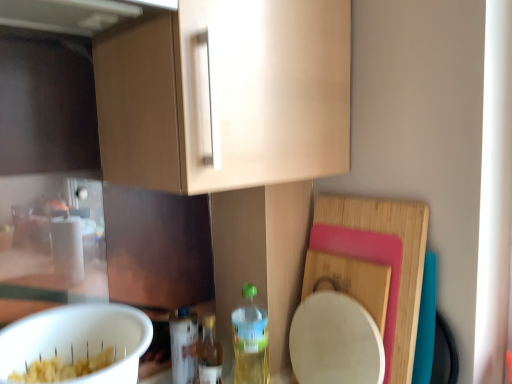
Question: Can you confirm if translucent plastic bottle at lower center, the third bottle in the right-to-left sequence, is smaller than translucent plastic bottle at lower center, the 2th bottle viewed from the right?

Choices:
 (A) no
 (B) yes

Answer: (A)

Question: Is translucent plastic bottle at lower center, arranged as the 1th bottle when viewed from the left, aimed at translucent plastic bottle at lower center, marked as the second bottle in a left-to-right arrangement?

Choices:
 (A) yes
 (B) no

Answer: (A)

Question: Is translucent plastic bottle at lower center, the third bottle in the right-to-left sequence, not near translucent plastic bottle at lower center, marked as the second bottle in a left-to-right arrangement?

Choices:
 (A) no
 (B) yes

Answer: (A)

Question: Does translucent plastic bottle at lower center, the third bottle in the right-to-left sequence, have a greater width compared to translucent plastic bottle at lower center, marked as the second bottle in a left-to-right arrangement?

Choices:
 (A) yes
 (B) no

Answer: (A)

Question: Does translucent plastic bottle at lower center, arranged as the 1th bottle when viewed from the left, have a greater height compared to translucent plastic bottle at lower center, marked as the second bottle in a left-to-right arrangement?

Choices:
 (A) yes
 (B) no

Answer: (B)

Question: Considering the relative positions of white matte mixing bowl at lower left and translucent plastic bottle at lower center, arranged as the 1th bottle when viewed from the left, in the image provided, is white matte mixing bowl at lower left to the left or to the right of translucent plastic bottle at lower center, arranged as the 1th bottle when viewed from the left,?

Choices:
 (A) left
 (B) right

Answer: (A)

Question: From the image's perspective, is white matte mixing bowl at lower left above or below translucent plastic bottle at lower center, the third bottle in the right-to-left sequence?

Choices:
 (A) above
 (B) below

Answer: (A)

Question: From a real-world perspective, is white matte mixing bowl at lower left positioned above or below translucent plastic bottle at lower center, the third bottle in the right-to-left sequence?

Choices:
 (A) above
 (B) below

Answer: (A)

Question: Based on their sizes in the image, would you say white matte mixing bowl at lower left is bigger or smaller than translucent plastic bottle at lower center, arranged as the 1th bottle when viewed from the left?

Choices:
 (A) small
 (B) big

Answer: (B)

Question: Considering the positions of translucent plastic bottle at lower center, the 2th bottle viewed from the right, and translucent plastic bottle at lower center, which is the 1th bottle from right to left, in the image, is translucent plastic bottle at lower center, the 2th bottle viewed from the right, taller or shorter than translucent plastic bottle at lower center, which is the 1th bottle from right to left,?

Choices:
 (A) short
 (B) tall

Answer: (A)

Question: From the image's perspective, is translucent plastic bottle at lower center, marked as the second bottle in a left-to-right arrangement, located above or below translucent plastic bottle at lower center, the third bottle when ordered from left to right?

Choices:
 (A) below
 (B) above

Answer: (A)

Question: In the image, is translucent plastic bottle at lower center, marked as the second bottle in a left-to-right arrangement, positioned in front of or behind translucent plastic bottle at lower center, the third bottle when ordered from left to right?

Choices:
 (A) front
 (B) behind

Answer: (B)

Question: Considering the positions of point (209, 336) and point (249, 286), is point (209, 336) closer or farther from the camera than point (249, 286)?

Choices:
 (A) farther
 (B) closer

Answer: (A)

Question: In terms of height, does translucent plastic bottle at lower center, the third bottle in the right-to-left sequence, look taller or shorter compared to translucent plastic bottle at lower center, which is the 1th bottle from right to left?

Choices:
 (A) tall
 (B) short

Answer: (B)

Question: Does point (189, 362) appear closer or farther from the camera than point (242, 304)?

Choices:
 (A) closer
 (B) farther

Answer: (A)